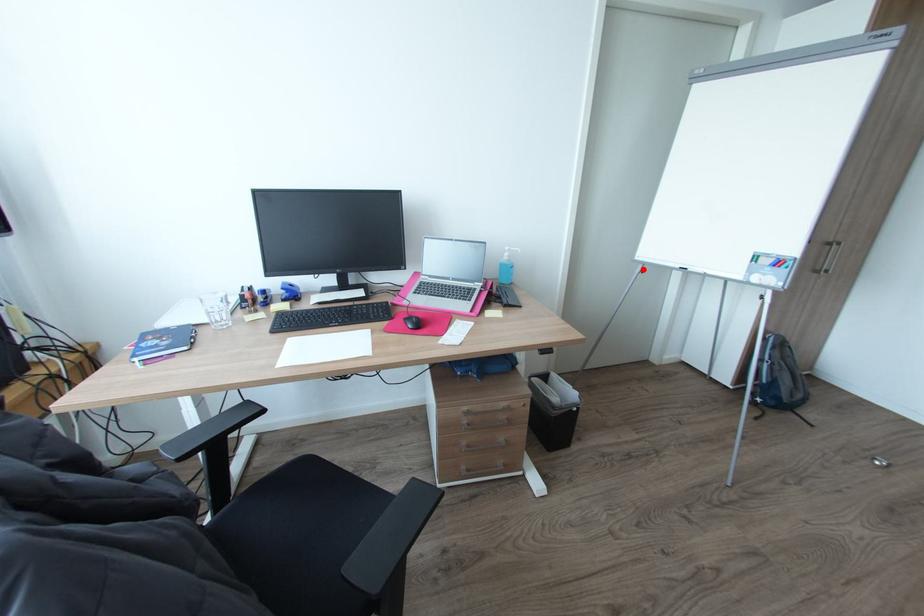
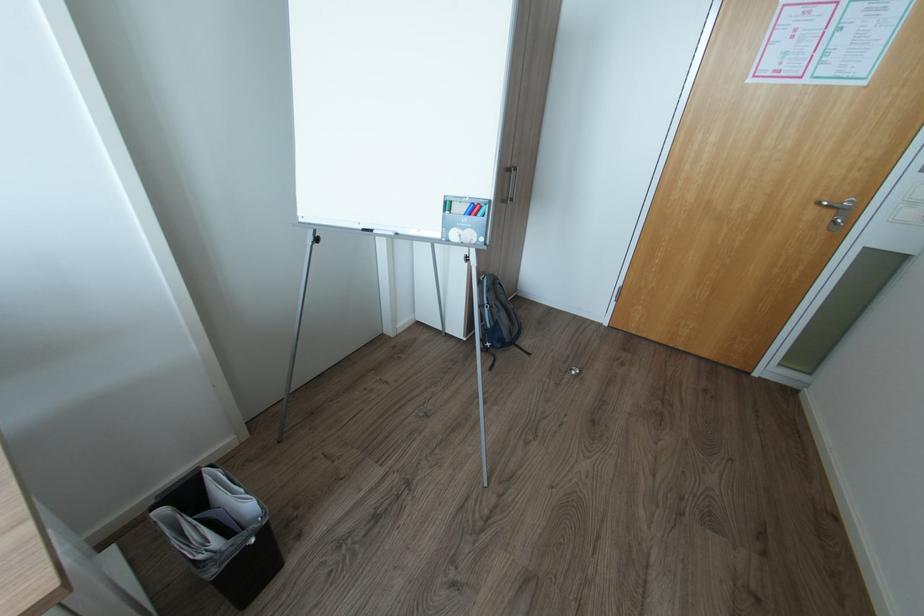
Find the pixel in the second image that matches the highlighted location in the first image.

(315, 238)